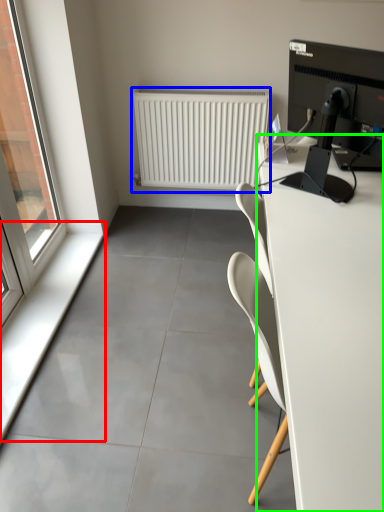
Question: Estimate the real-world distances between objects in this image. Which object is farther from window sill (highlighted by a red box), radiator (highlighted by a blue box) or desk (highlighted by a green box)?

Choices:
 (A) radiator
 (B) desk

Answer: (B)